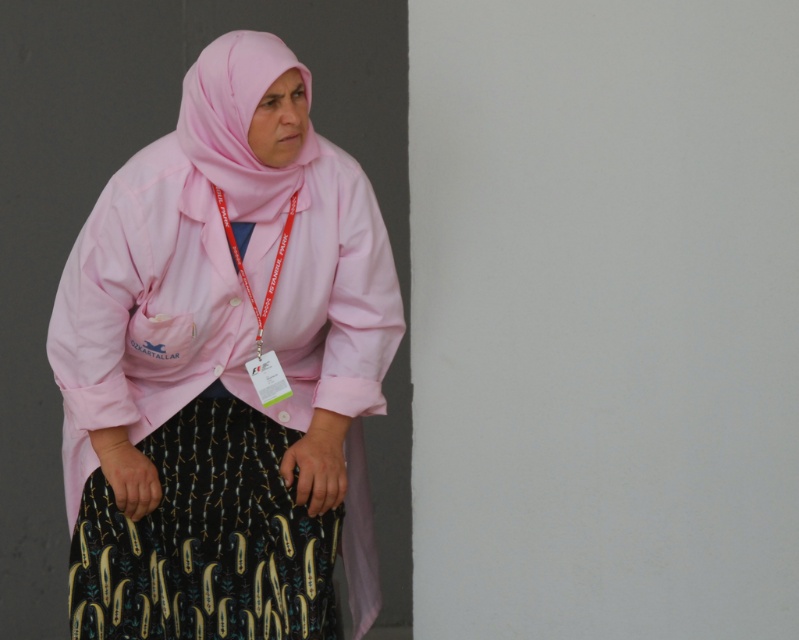
You are an architect designing a virtual reality space that needs to place two markers at the coordinates point (175, 340) and point (253, 100). According to the image, which marker should be placed further back in the 3D environment?

Point (175, 340) should be placed further back in the 3D environment because it is described as being behind point (253, 100).

You are an observer looking at the image. You notice the pink fabric hijab at upper left and the pink fabric headscarf at upper center. Which one is positioned lower?

The pink fabric hijab at upper left is positioned below the pink fabric headscarf at upper center, so it is lower.

You are a fashion designer analyzing the image of a person wearing two pink fabric items on their head. The items are the pink fabric hijab at upper left and the pink fabric headscarf at upper center. Which of these two items has a greater width?

The pink fabric hijab at upper left might be wider than pink fabric headscarf at upper center.